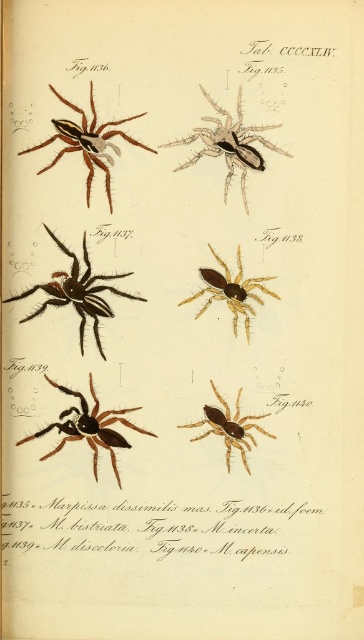
Does shiny brown spider at upper left appear over golden metallic spider at center?

Yes, shiny brown spider at upper left is above golden metallic spider at center.

Who is more forward, (107, 189) or (246, 330)?

Point (107, 189) is more forward.

The width and height of the screenshot is (364, 640). Identify the location of shiny brown spider at upper left. (88, 141).

Image resolution: width=364 pixels, height=640 pixels. In order to click on shiny brown spider at upper left in this screenshot , I will do `click(88, 141)`.

Locate an element on the screen. shiny black spider at center is located at coordinates (77, 292).

Between shiny black spider at center and shiny brown spider at center, which one appears on the left side from the viewer's perspective?

From the viewer's perspective, shiny black spider at center appears more on the left side.

Who is more distant from viewer, (9, 300) or (69, 429)?

The point (69, 429) is behind.

Locate an element on the screen. The height and width of the screenshot is (640, 364). shiny black spider at center is located at coordinates (77, 292).

Is black glossy spider at upper center shorter than golden metallic spider at center?

Incorrect, black glossy spider at upper center's height does not fall short of golden metallic spider at center's.

Can you confirm if black glossy spider at upper center is smaller than golden metallic spider at center?

Actually, black glossy spider at upper center might be larger than golden metallic spider at center.

At what (x,y) coordinates should I click in order to perform the action: click on black glossy spider at upper center. Please return your answer as a coordinate pair (x, y). This screenshot has width=364, height=640. Looking at the image, I should click on (228, 144).